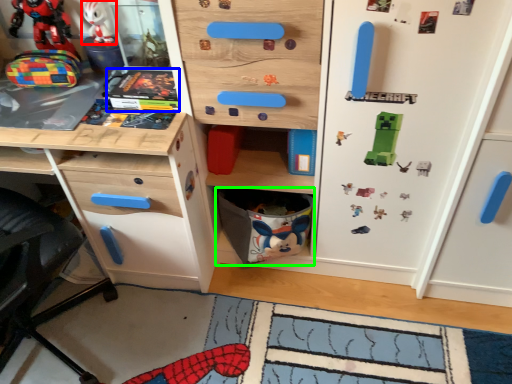
Question: Which object is positioned closest to toy (highlighted by a red box)? Select from comic book (highlighted by a blue box) and cabinet (highlighted by a green box).

Choices:
 (A) comic book
 (B) cabinet

Answer: (A)